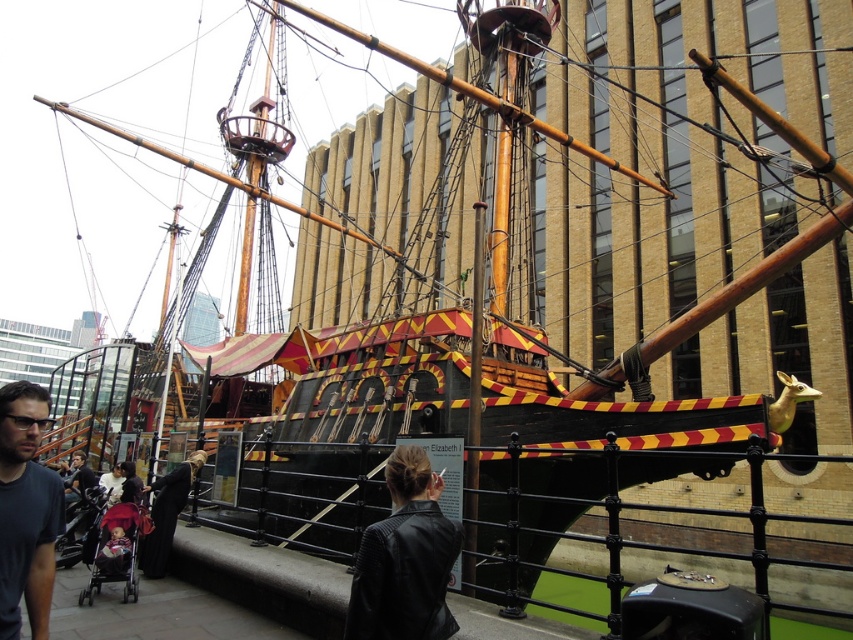
Between black leather jacket at center and dark gray t-shirt at left, which one is positioned higher?

Positioned higher is dark gray t-shirt at left.

Does black leather jacket at center have a lesser width compared to dark gray t-shirt at left?

Indeed, black leather jacket at center has a lesser width compared to dark gray t-shirt at left.

Is point (392, 611) closer to viewer compared to point (4, 456)?

Yes, point (392, 611) is in front of point (4, 456).

Where is `black leather jacket at center`? The image size is (853, 640). black leather jacket at center is located at coordinates (405, 557).